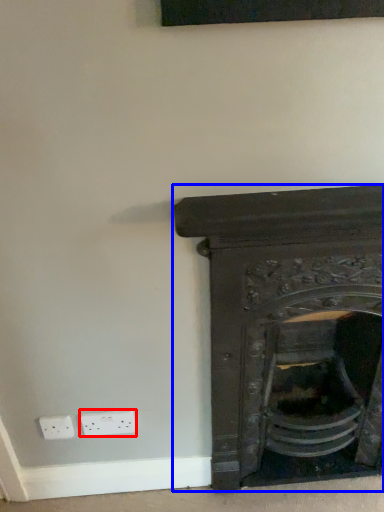
Question: Which of the following is the closest to the observer, electric outlet (highlighted by a red box) or fireplace (highlighted by a blue box)?

Choices:
 (A) electric outlet
 (B) fireplace

Answer: (B)